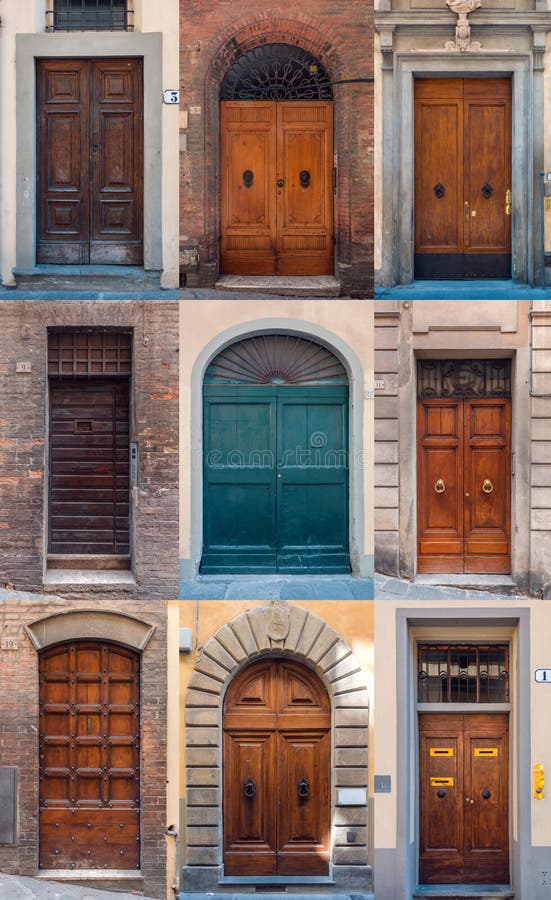
This screenshot has width=551, height=900. Find the location of `door frame top edge`. door frame top edge is located at coordinates (94, 320), (279, 327), (91, 54), (277, 45), (461, 68), (464, 352), (469, 623), (280, 654), (94, 640).